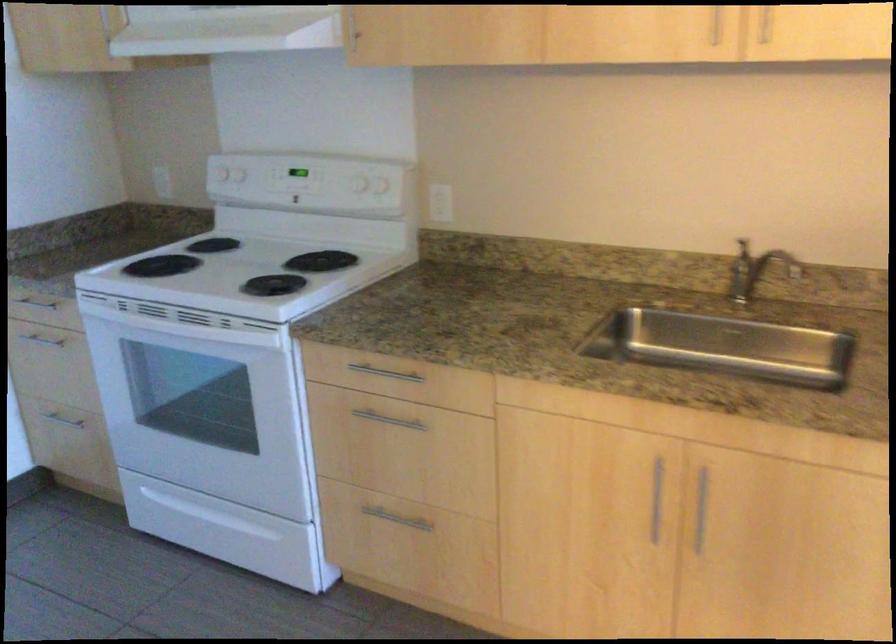
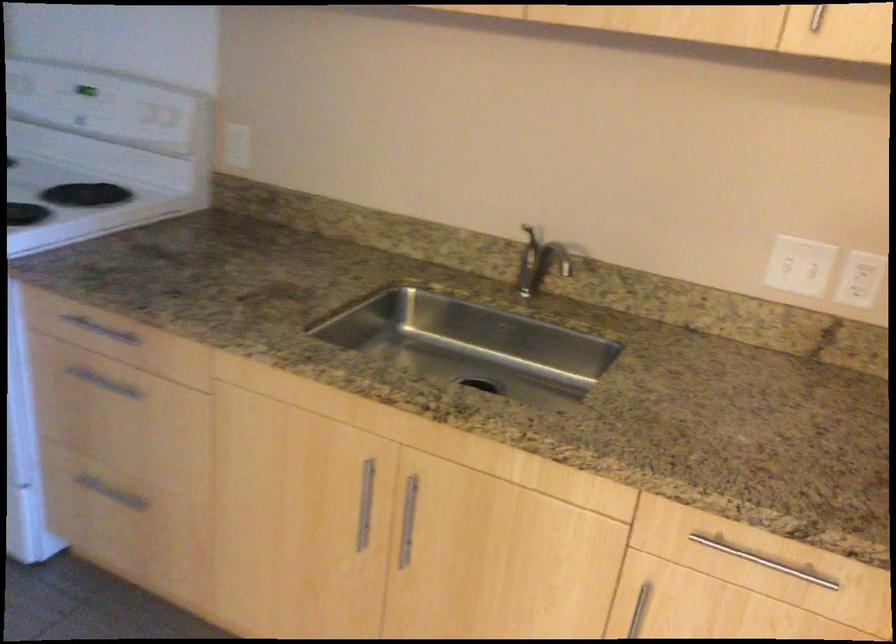
Locate, in the second image, the point that corresponds to [765,259] in the first image.

(545, 251)